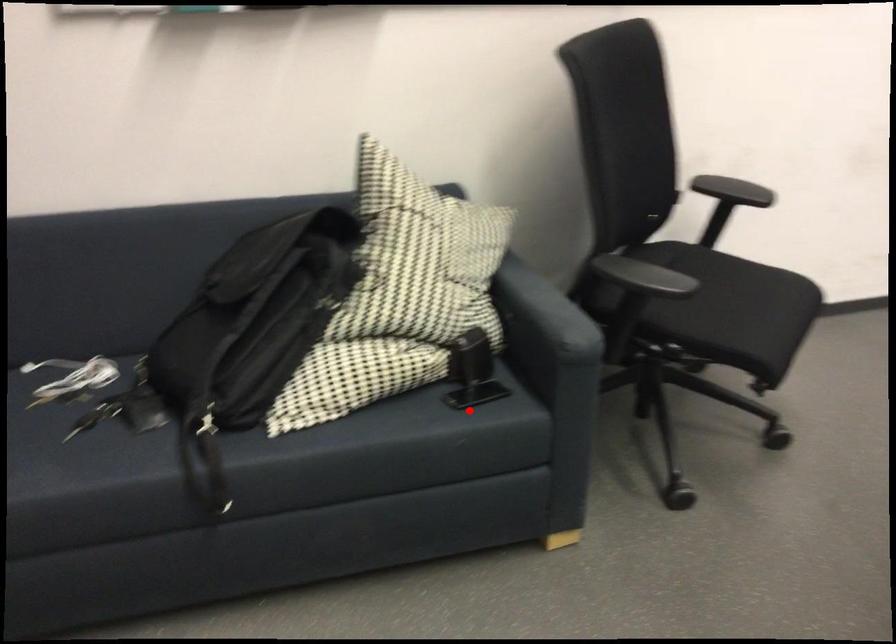
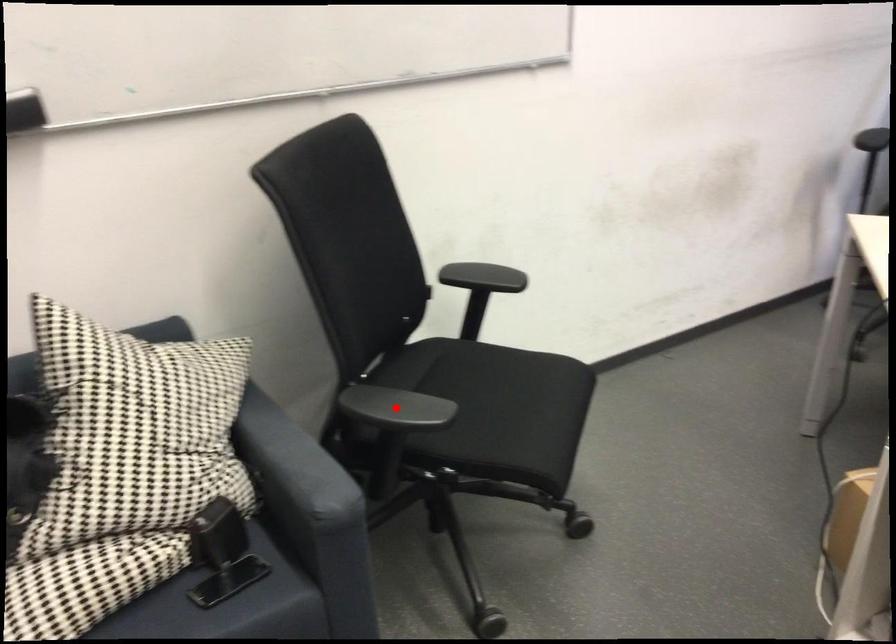
I am providing you with two images of the same scene from different viewpoints. A red point is marked on the first image and another point is marked on the second image. Does the point marked in image1 correspond to the same location as the one in image2?

No